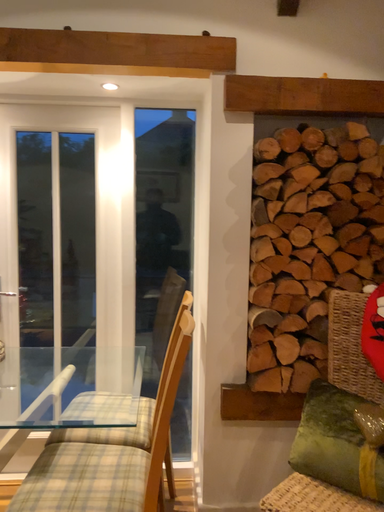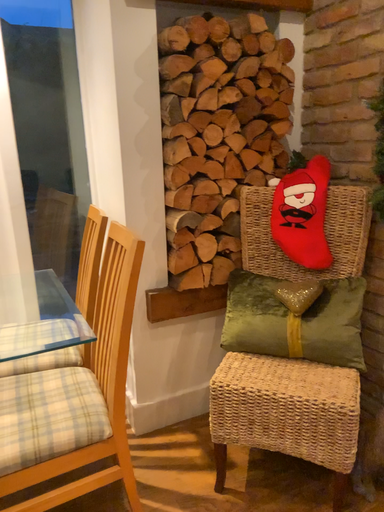
Question: How did the camera likely rotate when shooting the video?

Choices:
 (A) rotated upward
 (B) rotated downward

Answer: (B)